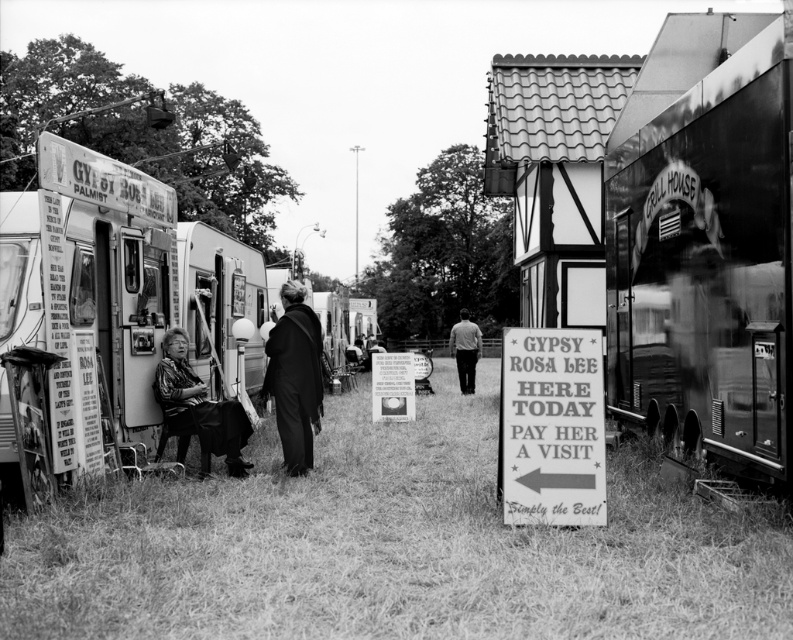
Question: Which object appears farthest from the camera in this image?

Choices:
 (A) rustic wood food truck at left
 (B) grassy field at center
 (C) dark fabric chair at left

Answer: (C)

Question: Can you confirm if shiny black grill house at right is wider than dark fabric chair at left?

Choices:
 (A) yes
 (B) no

Answer: (B)

Question: Does shiny black grill house at right appear over dark fabric chair at left?

Choices:
 (A) no
 (B) yes

Answer: (B)

Question: In this image, where is wooden sign at center located relative to dark fabric chair at left?

Choices:
 (A) left
 (B) right

Answer: (B)

Question: Among these objects, which one is farthest from the camera?

Choices:
 (A) smooth gray shirt at center
 (B) smooth black coat at center
 (C) wooden sign at center

Answer: (A)

Question: Estimate the real-world distances between objects in this image. Which object is closer to the rustic wood food truck at left?

Choices:
 (A) smooth gray shirt at center
 (B) grassy field at center
 (C) white paper sign at center

Answer: (B)